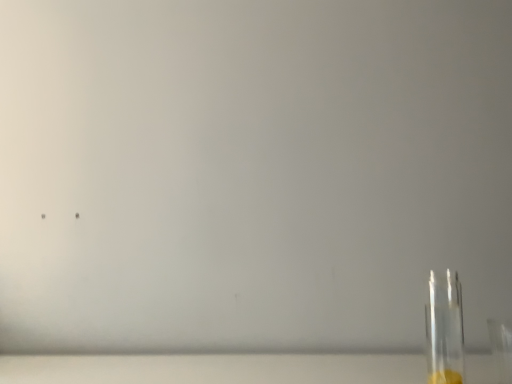
Question: Is transparent glass bottle at right positioned far away from transparent glass table at lower right?

Choices:
 (A) yes
 (B) no

Answer: (B)

Question: Considering the relative sizes of transparent glass bottle at right and transparent glass table at lower right in the image provided, is transparent glass bottle at right taller than transparent glass table at lower right?

Choices:
 (A) yes
 (B) no

Answer: (A)

Question: Does transparent glass bottle at right have a smaller size compared to transparent glass table at lower right?

Choices:
 (A) yes
 (B) no

Answer: (A)

Question: Is transparent glass bottle at right shorter than transparent glass table at lower right?

Choices:
 (A) yes
 (B) no

Answer: (B)

Question: Could you tell me if transparent glass bottle at right is facing transparent glass table at lower right?

Choices:
 (A) no
 (B) yes

Answer: (A)

Question: Are transparent glass bottle at right and transparent glass table at lower right beside each other?

Choices:
 (A) no
 (B) yes

Answer: (A)

Question: Is transparent glass table at lower right outside of transparent glass bottle at right?

Choices:
 (A) no
 (B) yes

Answer: (B)

Question: Is transparent glass table at lower right shorter than transparent glass bottle at right?

Choices:
 (A) no
 (B) yes

Answer: (B)

Question: Is the surface of transparent glass table at lower right in direct contact with transparent glass bottle at right?

Choices:
 (A) no
 (B) yes

Answer: (A)

Question: From a real-world perspective, is transparent glass table at lower right under transparent glass bottle at right?

Choices:
 (A) yes
 (B) no

Answer: (A)

Question: From the image's perspective, would you say transparent glass table at lower right is positioned over transparent glass bottle at right?

Choices:
 (A) no
 (B) yes

Answer: (A)

Question: Can you confirm if transparent glass table at lower right is thinner than transparent glass bottle at right?

Choices:
 (A) yes
 (B) no

Answer: (B)

Question: Is point (54, 364) positioned closer to the camera than point (442, 291)?

Choices:
 (A) closer
 (B) farther

Answer: (A)